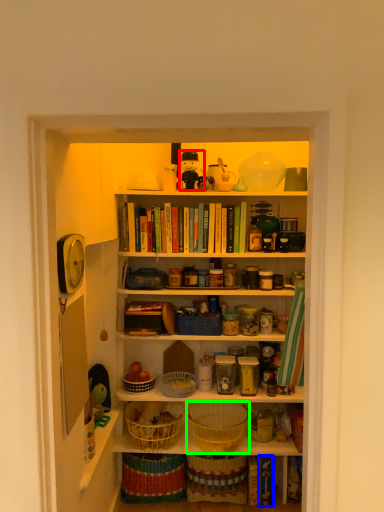
Question: Estimate the real-world distances between objects in this image. Which object is closer to toy (highlighted by a red box), book (highlighted by a blue box) or basket (highlighted by a green box)?

Choices:
 (A) book
 (B) basket

Answer: (B)